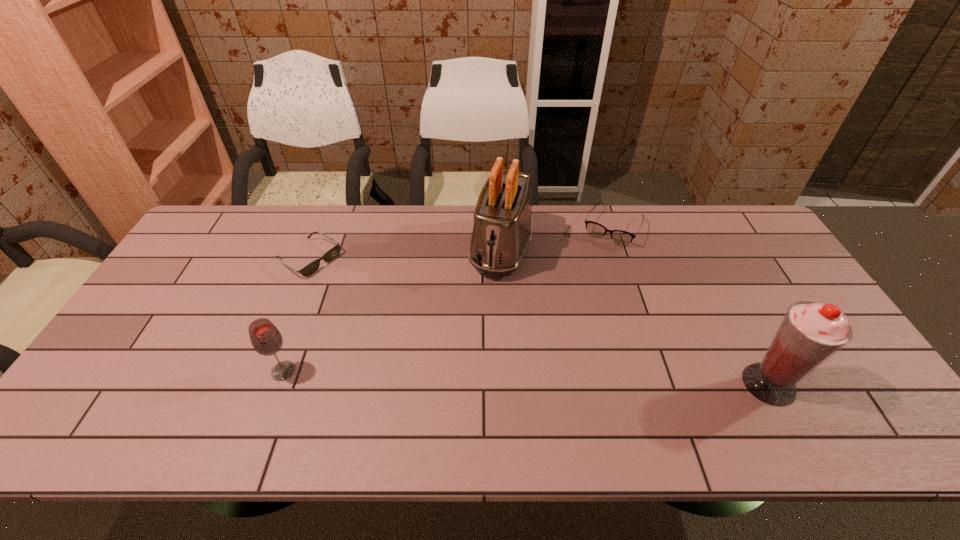
This screenshot has height=540, width=960. Find the location of `glass drink container at the near edge`. glass drink container at the near edge is located at coordinates (266, 339).

Locate an element on the screen. smoothie at the near edge is located at coordinates (810, 333).

Identify the location of vacant area at the far edge of the desktop. This screenshot has height=540, width=960. (254, 224).

This screenshot has height=540, width=960. What are the coordinates of `free space at the near edge of the desktop` in the screenshot? It's located at (272, 380).

Find the location of a particular element. This screenshot has width=960, height=540. vacant space at the left edge of the desktop is located at coordinates (169, 280).

You are a GUI agent. You are given a task and a screenshot of the screen. Output one action in this format:
    pyautogui.click(x=<x>, y=<y>)
    Task: Click on the vacant point at the right edge
    
    Given the screenshot: What is the action you would take?
    pyautogui.click(x=751, y=261)

In the image, there is a desktop. Where is `vacant space at the far left corner`? The width and height of the screenshot is (960, 540). vacant space at the far left corner is located at coordinates (256, 218).

The width and height of the screenshot is (960, 540). I want to click on vacant space that's between the shortest object and the second shortest object, so click(x=461, y=243).

This screenshot has height=540, width=960. I want to click on free space between the smoothie and the third tallest object, so click(526, 377).

Find the location of a particular element. The image size is (960, 540). free space between the third object from left to right and the rightmost object is located at coordinates (636, 316).